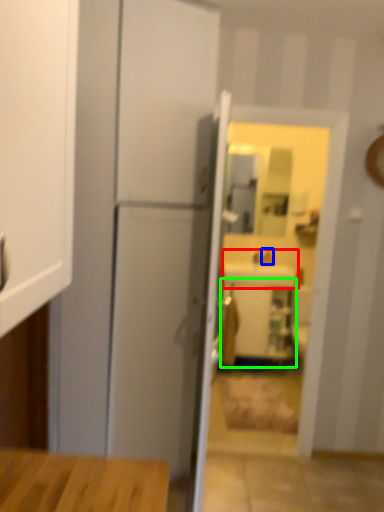
Question: Which object is positioned farthest from sink (highlighted by a red box)? Select from faucet (highlighted by a blue box) and cabinetry (highlighted by a green box).

Choices:
 (A) faucet
 (B) cabinetry

Answer: (B)